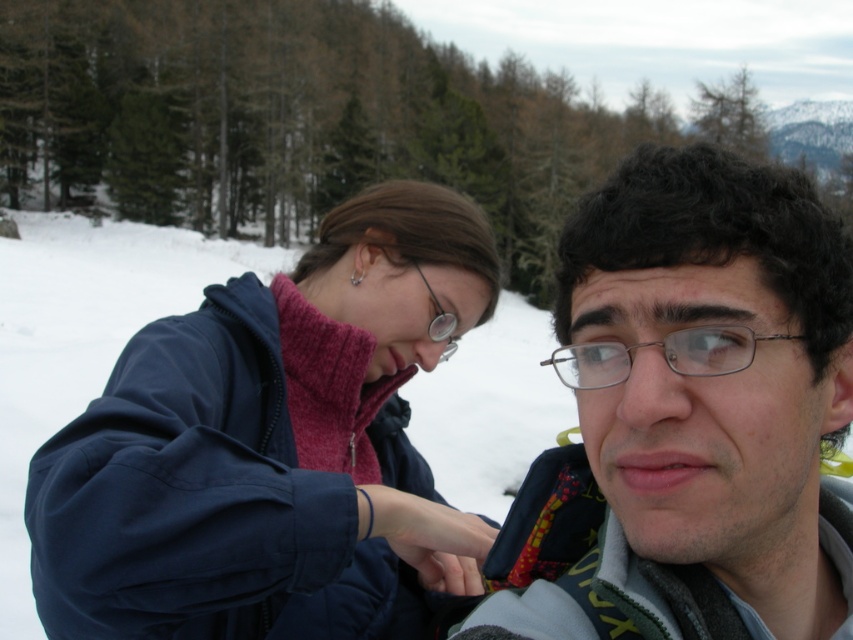
Does metallic silver glasses at center appear on the right side of matte metal glasses at upper center?

Correct, you'll find metallic silver glasses at center to the right of matte metal glasses at upper center.

Between point (592, 342) and point (438, 316), which one is positioned in front?

Point (592, 342) is more forward.

Between point (737, 326) and point (447, 349), which one is positioned in front?

Positioned in front is point (737, 326).

Identify the location of metallic silver glasses at center. (662, 355).

Is matte black glasses at center behind matte metal glasses at upper center?

No, matte black glasses at center is closer to the viewer.

Which is above, matte black glasses at center or matte metal glasses at upper center?

matte metal glasses at upper center

Which is in front, point (701, 348) or point (434, 304)?

Point (701, 348)

Locate an element on the screen. matte black glasses at center is located at coordinates (689, 417).

Is matte black glasses at center above metallic silver glasses at center?

Actually, matte black glasses at center is below metallic silver glasses at center.

Is matte black glasses at center bigger than metallic silver glasses at center?

Correct, matte black glasses at center is larger in size than metallic silver glasses at center.

Describe the element at coordinates (689, 417) in the screenshot. The image size is (853, 640). I see `matte black glasses at center` at that location.

Find the location of a particular element. matte black glasses at center is located at coordinates (689, 417).